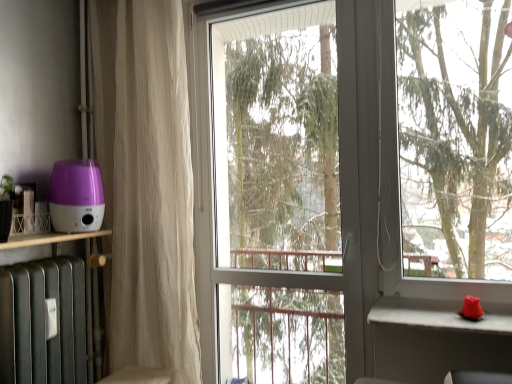
At what (x,y) coordinates should I click in order to perform the action: click on blank space above white concrete window sill at right (from a real-world perspective). Please return your answer as a coordinate pair (x, y). Looking at the image, I should click on (426, 310).